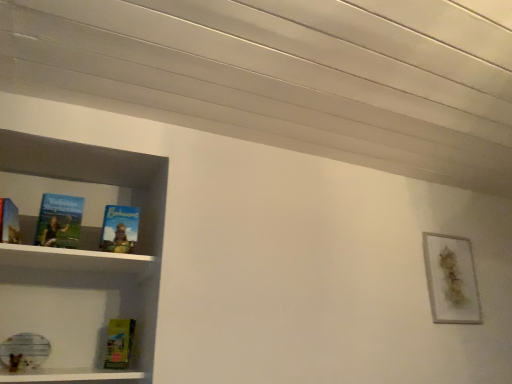
Question: Can you confirm if blue matte book at center, the 2th book positioned from the left, is taller than yellow matte paperback book at lower left?

Choices:
 (A) yes
 (B) no

Answer: (A)

Question: Does blue matte book at center, the first book viewed from the right, contain yellow matte paperback book at lower left?

Choices:
 (A) no
 (B) yes

Answer: (A)

Question: Is blue matte book at center, the 2th book positioned from the left, facing towards yellow matte paperback book at lower left?

Choices:
 (A) no
 (B) yes

Answer: (A)

Question: Is there a large distance between blue matte book at center, the 2th book positioned from the left, and yellow matte paperback book at lower left?

Choices:
 (A) no
 (B) yes

Answer: (A)

Question: Considering the relative positions of blue matte book at center, the first book viewed from the right, and yellow matte paperback book at lower left in the image provided, is blue matte book at center, the first book viewed from the right, to the right of yellow matte paperback book at lower left from the viewer's perspective?

Choices:
 (A) no
 (B) yes

Answer: (B)

Question: In terms of size, does yellow matte paperback book at lower left appear bigger or smaller than matte blue book at left, which is the 1th book in left-to-right order?

Choices:
 (A) big
 (B) small

Answer: (B)

Question: Considering their positions, is yellow matte paperback book at lower left located in front of or behind matte blue book at left, which is the 1th book in left-to-right order?

Choices:
 (A) behind
 (B) front

Answer: (A)

Question: Is yellow matte paperback book at lower left taller or shorter than matte blue book at left, positioned as the 2th book in right-to-left order?

Choices:
 (A) tall
 (B) short

Answer: (B)

Question: Which is correct: yellow matte paperback book at lower left is inside matte blue book at left, positioned as the 2th book in right-to-left order, or outside of it?

Choices:
 (A) outside
 (B) inside

Answer: (A)

Question: From a real-world perspective, is matte blue book at left, which is the 1th book in left-to-right order, physically located above or below gold textured frame at upper right?

Choices:
 (A) above
 (B) below

Answer: (A)

Question: In terms of width, does matte blue book at left, positioned as the 2th book in right-to-left order, look wider or thinner when compared to gold textured frame at upper right?

Choices:
 (A) thin
 (B) wide

Answer: (B)

Question: Relative to gold textured frame at upper right, is matte blue book at left, positioned as the 2th book in right-to-left order, in front or behind?

Choices:
 (A) behind
 (B) front

Answer: (B)

Question: In terms of height, does matte blue book at left, which is the 1th book in left-to-right order, look taller or shorter compared to gold textured frame at upper right?

Choices:
 (A) short
 (B) tall

Answer: (A)

Question: In terms of width, does yellow matte paperback book at lower left look wider or thinner when compared to gold textured frame at upper right?

Choices:
 (A) wide
 (B) thin

Answer: (B)

Question: Is yellow matte paperback book at lower left taller or shorter than gold textured frame at upper right?

Choices:
 (A) tall
 (B) short

Answer: (B)